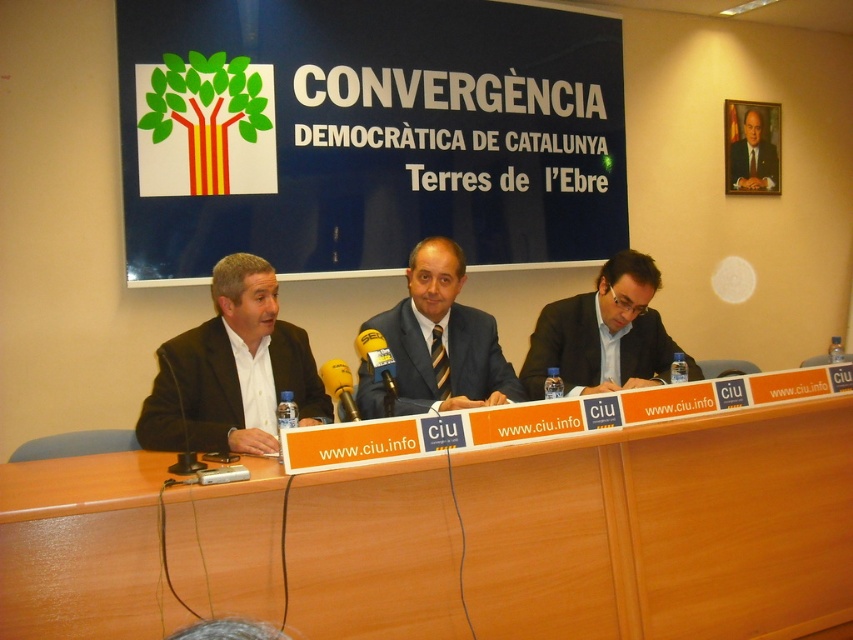
You are a photographer at the press conference. You need to capture a photo where the matte black suit at center is positioned to the right of the metallic yellow microphone at center. Does the current arrangement allow this?

Yes, the current arrangement allows the matte black suit at center to be positioned to the right of the metallic yellow microphone at center as described.

You are a photographer adjusting camera settings to capture a clear shot of the matte black suit at left and the metallic silver microphone at center. Which object should you focus on first if you want to ensure both are in focus, considering their relative sizes in the frame?

The matte black suit at left is taller than the metallic silver microphone at center, so focusing on the taller object first would help ensure both are in focus as you adjust the camera settings.

You are a photographer at the press conference. You need to position a microphone stand at point (231, 371). Which person in the image is closest to that point?

The person wearing the matte black suit at left is located at point (231, 371), so they are the closest to that point.